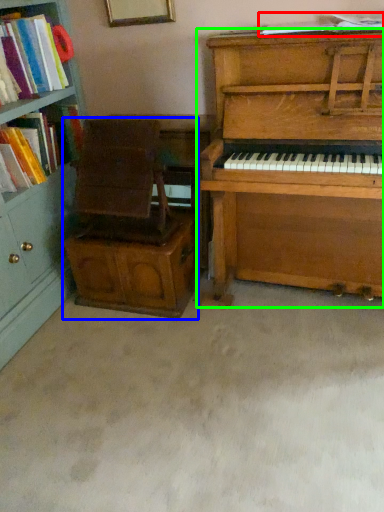
Question: Considering the real-world distances, which object is farthest from book (highlighted by a red box)? armchair (highlighted by a blue box) or piano (highlighted by a green box)?

Choices:
 (A) armchair
 (B) piano

Answer: (A)